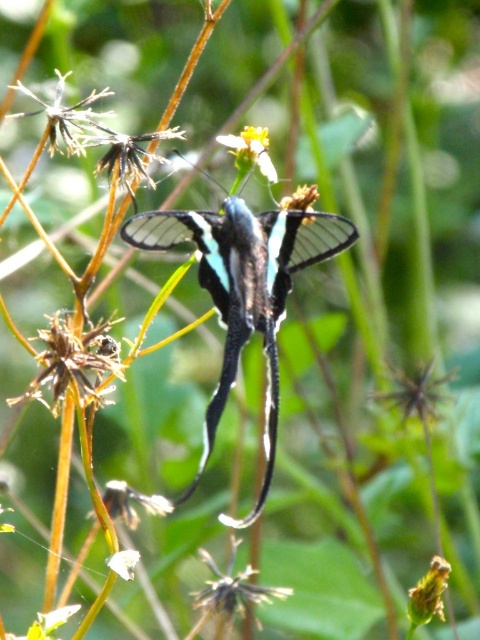
Between brown dried seed head at upper left and green matte flower at lower right, which one appears on the right side from the viewer's perspective?

Positioned to the right is green matte flower at lower right.

Based on the photo, can you confirm if brown dried seed head at upper left is shorter than green matte flower at lower right?

No.

Is point (97, 124) positioned in front of point (441, 600)?

That is True.

Where is `brown dried seed head at upper left`? The image size is (480, 640). brown dried seed head at upper left is located at coordinates (66, 115).

Which is above, translucent glass butterfly at center or brown dried seed head at upper left?

brown dried seed head at upper left

The height and width of the screenshot is (640, 480). I want to click on translucent glass butterfly at center, so click(244, 289).

Between translucent glass butterfly at center and green matte flower at lower right, which one has less height?

Standing shorter between the two is green matte flower at lower right.

Is translucent glass butterfly at center closer to camera compared to green matte flower at lower right?

Yes, it is.

Who is more distant from viewer, [170,246] or [431,572]?

The point [431,572] is behind.

You are a GUI agent. You are given a task and a screenshot of the screen. Output one action in this format:
    pyautogui.click(x=<x>, y=<y>)
    Task: Click on the translucent glass butterfly at center
    The image size is (480, 640).
    Given the screenshot: What is the action you would take?
    pyautogui.click(x=244, y=289)